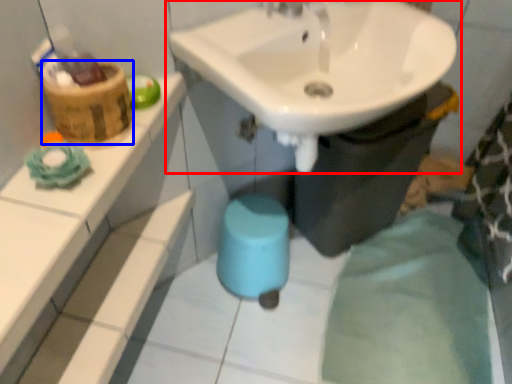
Question: Which of the following is the farthest to the observer, sink (highlighted by a red box) or basket (highlighted by a blue box)?

Choices:
 (A) sink
 (B) basket

Answer: (B)